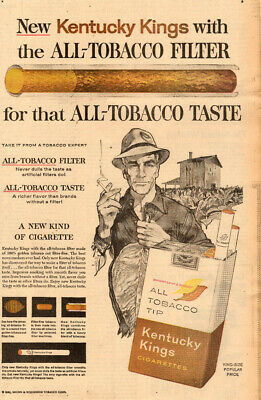
Find the location of a particular element. This screenshot has width=261, height=400. box is located at coordinates (169, 315).